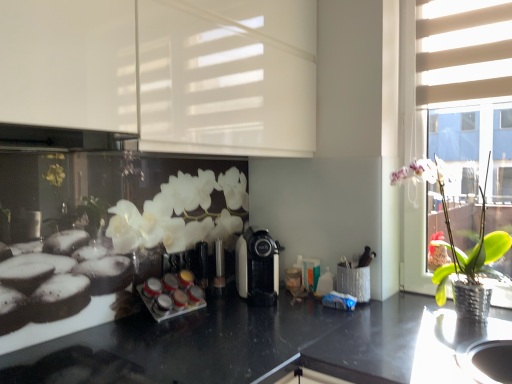
Question: Is white glossy spice rack at center taller than black plastic coffee machine at center?

Choices:
 (A) yes
 (B) no

Answer: (B)

Question: Does white glossy spice rack at center have a lesser width compared to black plastic coffee machine at center?

Choices:
 (A) yes
 (B) no

Answer: (A)

Question: Would you say black plastic coffee machine at center is part of white glossy spice rack at center's contents?

Choices:
 (A) yes
 (B) no

Answer: (B)

Question: Is white glossy spice rack at center in front of black plastic coffee machine at center?

Choices:
 (A) no
 (B) yes

Answer: (B)

Question: From a real-world perspective, is white glossy spice rack at center under black plastic coffee machine at center?

Choices:
 (A) no
 (B) yes

Answer: (B)

Question: Considering the relative sizes of white glossy spice rack at center and black plastic coffee machine at center in the image provided, is white glossy spice rack at center wider than black plastic coffee machine at center?

Choices:
 (A) no
 (B) yes

Answer: (A)

Question: Considering the relative sizes of white glossy spice rack at center and green leafy plant in metallic pot at right in the image provided, is white glossy spice rack at center smaller than green leafy plant in metallic pot at right?

Choices:
 (A) yes
 (B) no

Answer: (A)

Question: Is the position of white glossy spice rack at center more distant than that of green leafy plant in metallic pot at right?

Choices:
 (A) yes
 (B) no

Answer: (A)

Question: From the image's perspective, would you say white glossy spice rack at center is shown under green leafy plant in metallic pot at right?

Choices:
 (A) yes
 (B) no

Answer: (A)

Question: Considering the relative sizes of white glossy spice rack at center and green leafy plant in metallic pot at right in the image provided, is white glossy spice rack at center taller than green leafy plant in metallic pot at right?

Choices:
 (A) yes
 (B) no

Answer: (B)

Question: Is white glossy spice rack at center not within green leafy plant in metallic pot at right?

Choices:
 (A) yes
 (B) no

Answer: (A)

Question: From a real-world perspective, is white glossy spice rack at center located higher than green leafy plant in metallic pot at right?

Choices:
 (A) yes
 (B) no

Answer: (B)

Question: Is green leafy plant in metallic pot at right touching white glossy cabinet at upper left, positioned as the second shutter in right-to-left order?

Choices:
 (A) no
 (B) yes

Answer: (A)